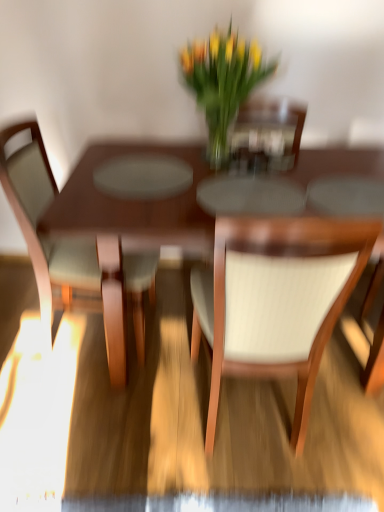
Identify the location of vacant region above wooden table at center (from a real-world perspective). The height and width of the screenshot is (512, 384). (212, 188).